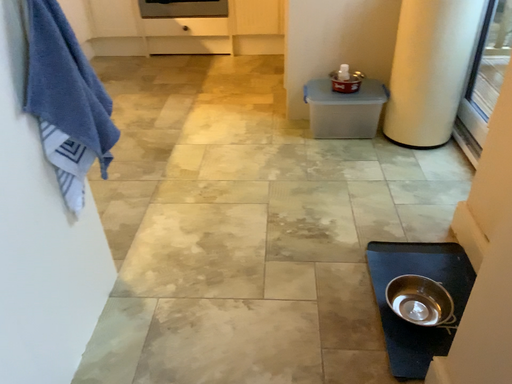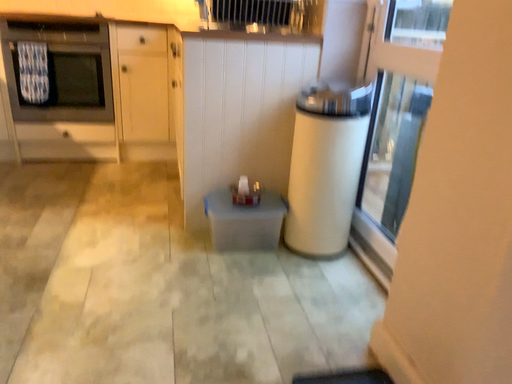
Question: How did the camera likely rotate when shooting the video?

Choices:
 (A) rotated upward
 (B) rotated downward

Answer: (A)